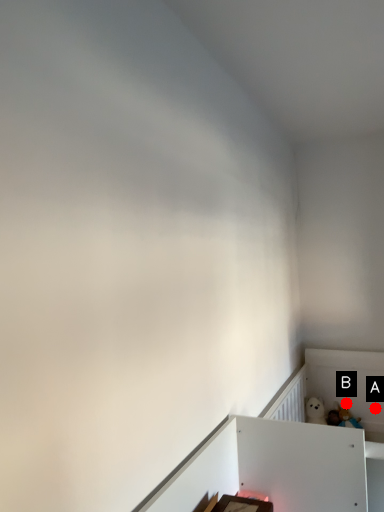
Question: Two points are circled on the image, labeled by A and B beside each circle. Which of the following is the closest to the observer?

Choices:
 (A) A is closer
 (B) B is closer

Answer: (A)